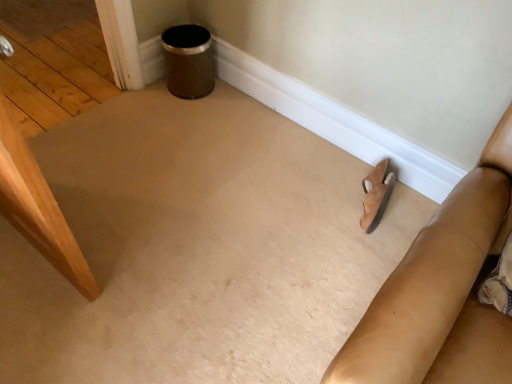
Question: Should I look upward or downward to see suede-like tan couch at lower right?

Choices:
 (A) up
 (B) down

Answer: (B)

Question: Does suede-like tan couch at lower right have a lesser width compared to suede sandal at lower right?

Choices:
 (A) no
 (B) yes

Answer: (A)

Question: Can you confirm if suede-like tan couch at lower right is positioned to the left of suede sandal at lower right?

Choices:
 (A) no
 (B) yes

Answer: (A)

Question: Would you say suede-like tan couch at lower right is a long distance from suede sandal at lower right?

Choices:
 (A) yes
 (B) no

Answer: (B)

Question: From a real-world perspective, is suede-like tan couch at lower right on suede sandal at lower right?

Choices:
 (A) no
 (B) yes

Answer: (B)

Question: From the image's perspective, is suede-like tan couch at lower right over suede sandal at lower right?

Choices:
 (A) yes
 (B) no

Answer: (B)

Question: Is suede-like tan couch at lower right looking in the opposite direction of suede sandal at lower right?

Choices:
 (A) no
 (B) yes

Answer: (A)

Question: Is suede sandal at lower right smaller than suede-like tan couch at lower right?

Choices:
 (A) yes
 (B) no

Answer: (A)

Question: Is suede sandal at lower right at the left side of suede-like tan couch at lower right?

Choices:
 (A) no
 (B) yes

Answer: (B)

Question: From the image's perspective, is suede sandal at lower right located beneath suede-like tan couch at lower right?

Choices:
 (A) yes
 (B) no

Answer: (B)

Question: From a real-world perspective, is suede sandal at lower right on top of suede-like tan couch at lower right?

Choices:
 (A) yes
 (B) no

Answer: (B)

Question: Is the depth of suede sandal at lower right less than that of suede-like tan couch at lower right?

Choices:
 (A) yes
 (B) no

Answer: (B)

Question: Is suede sandal at lower right shorter than suede-like tan couch at lower right?

Choices:
 (A) no
 (B) yes

Answer: (B)

Question: From the image's perspective, is suede-like tan couch at lower right positioned above or below suede sandal at lower right?

Choices:
 (A) below
 (B) above

Answer: (A)